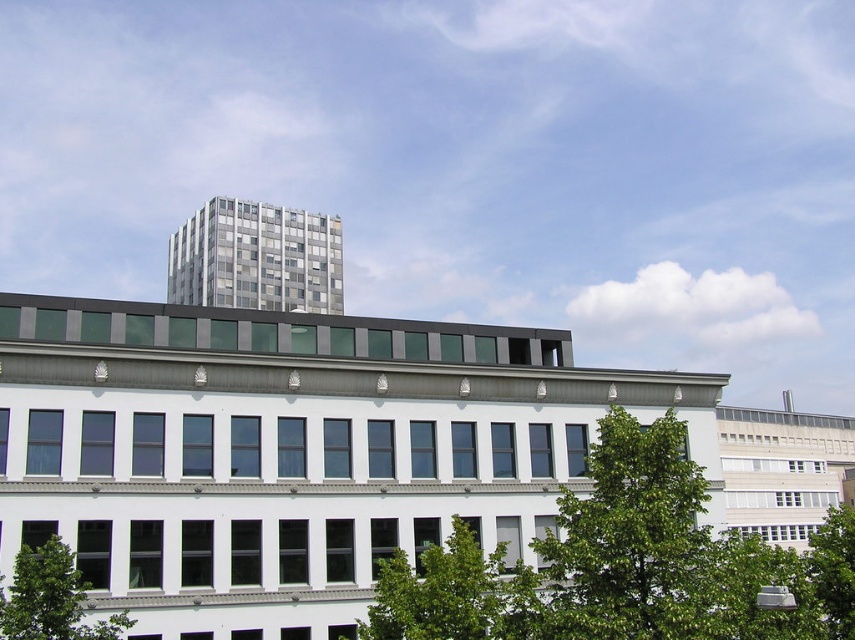
You are standing at the camera position and want to water the green leafy tree at lower center. If your watering can has a maximum range of 60 feet, will you need to move closer to water it?

The green leafy tree at lower center is 61.22 feet away from the camera, which exceeds the watering can range of 60 feet. Therefore, you need to move closer to water it.

You are standing at the center of the image. Which direction should you look to see the green leafy tree at lower left?

The green leafy tree at lower left is located at point coordinates of [50,598], so you should look to the lower left direction to see it.